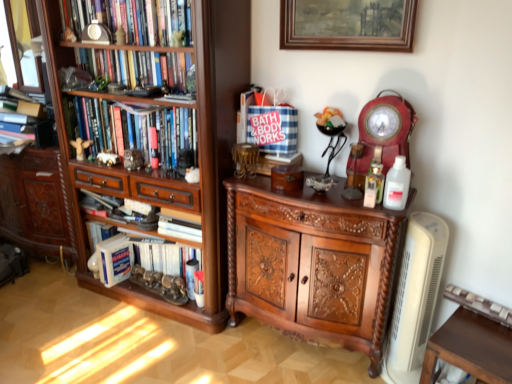
Question: In terms of height, does white plastic bottle at right look taller or shorter compared to matte gold angel at left, marked as the 2th toy in a right-to-left arrangement?

Choices:
 (A) short
 (B) tall

Answer: (B)

Question: Looking at the image, does white plastic bottle at right seem bigger or smaller compared to matte gold angel at left, marked as the 2th toy in a right-to-left arrangement?

Choices:
 (A) small
 (B) big

Answer: (B)

Question: Estimate the real-world distances between objects in this image. Which object is farther from the hardcover book at lower left?

Choices:
 (A) hardcover books at left, which is counted as the second book, starting from the bottom
 (B) gold metallic toy car at left, the 1th toy when ordered from right to left
 (C) hardcover books at upper left, which appears as the second book when viewed from the top
 (D) wooden carved cabinet at left
 (E) wooden bookshelf at left

Answer: (C)

Question: Estimate the real-world distances between objects in this image. Which object is farther from the matte white clock at upper left, which is the 4th book in bottom-to-top order?

Choices:
 (A) wooden bookshelf at left
 (B) hardcover book at lower left
 (C) gold metallic toy car at left, marked as the second toy in a left-to-right arrangement
 (D) polished wood cabinet at center
 (E) brown wooden table at lower right

Answer: (E)